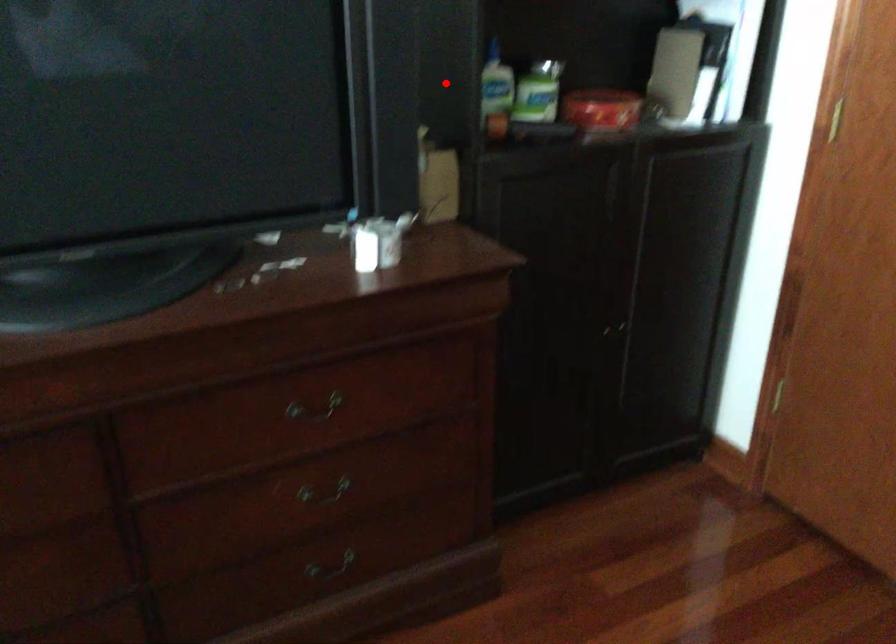
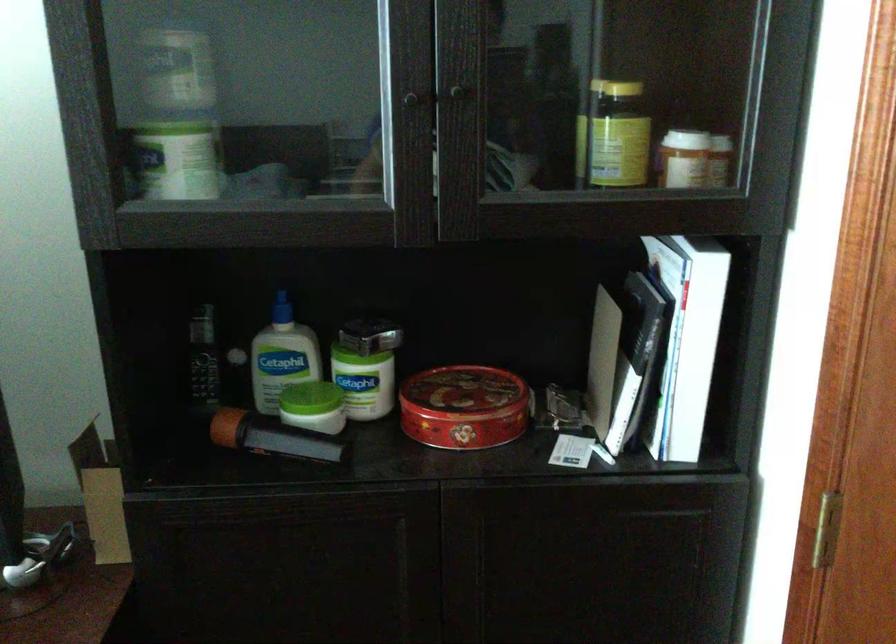
Question: I am providing you with two images of the same scene from different viewpoints. In image1, a red point is highlighted. Considering the same 3D point in image2, which of the following is correct?

Choices:
 (A) It is closer
 (B) It is farther

Answer: (A)